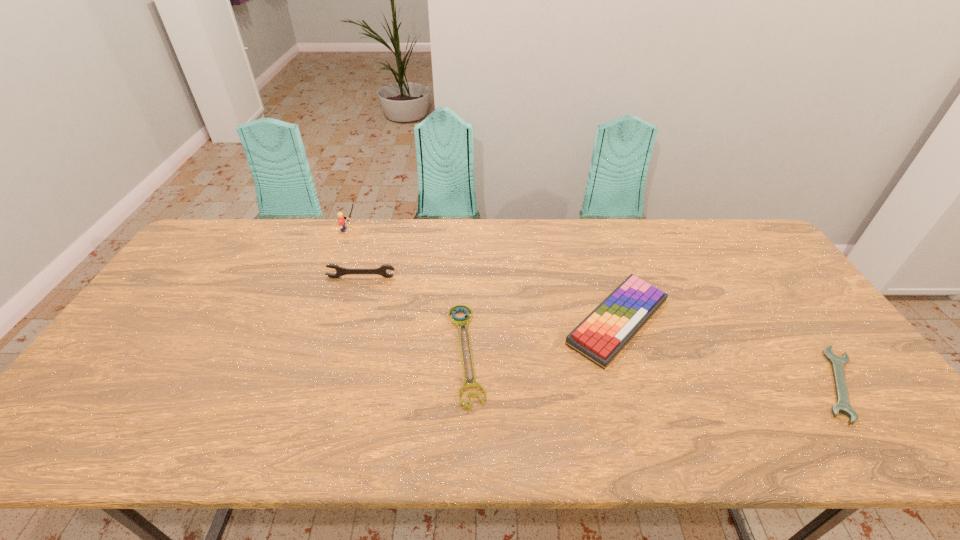
Image resolution: width=960 pixels, height=540 pixels. Find the location of `free spot that satisfies the following two spatial constraints: 1. on the open ends of the fourth nearest object; 2. on the left side of the computer keyboard`. free spot that satisfies the following two spatial constraints: 1. on the open ends of the fourth nearest object; 2. on the left side of the computer keyboard is located at coordinates (348, 321).

What are the coordinates of `vacant space that satisfies the following two spatial constraints: 1. on the open ends of the tallest wrench; 2. on the left side of the fourth object from left to right` in the screenshot? It's located at (348, 321).

Where is `free space that satisfies the following two spatial constraints: 1. on the front-facing side of the third object from left to right; 2. on the right side of the tallest object`? free space that satisfies the following two spatial constraints: 1. on the front-facing side of the third object from left to right; 2. on the right side of the tallest object is located at coordinates (303, 353).

This screenshot has width=960, height=540. Find the location of `vacant space that satisfies the following two spatial constraints: 1. on the front-facing side of the fourth object from left to right; 2. on the right side of the farthest object`. vacant space that satisfies the following two spatial constraints: 1. on the front-facing side of the fourth object from left to right; 2. on the right side of the farthest object is located at coordinates (316, 321).

Find the location of a particular element. Image resolution: width=960 pixels, height=540 pixels. vacant region that satisfies the following two spatial constraints: 1. on the back side of the rightmost wrench; 2. on the front-facing side of the farthest object is located at coordinates (730, 230).